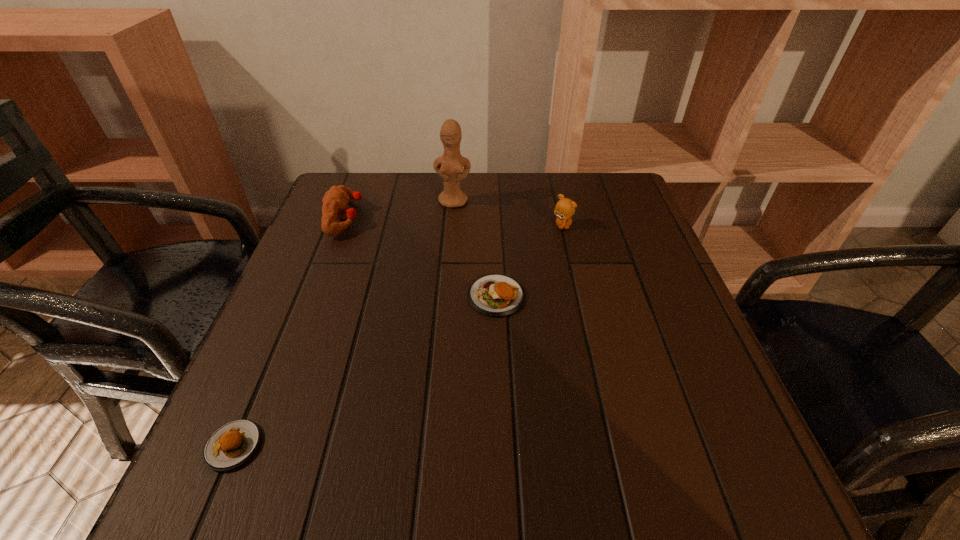
At what (x,y) coordinates should I click in order to perform the action: click on free region at the far edge. Please return your answer as a coordinate pair (x, y). This screenshot has width=960, height=540. Looking at the image, I should click on (485, 218).

You are a GUI agent. You are given a task and a screenshot of the screen. Output one action in this format:
    pyautogui.click(x=<x>, y=<y>)
    Task: Click on the vacant space at the near edge of the desktop
    Image resolution: width=960 pixels, height=540 pixels.
    Given the screenshot: What is the action you would take?
    pyautogui.click(x=648, y=476)

Locate an element on the screen. vacant space at the left edge of the desktop is located at coordinates [x=278, y=363].

Identify the location of vacant space at the right edge of the desktop. (652, 342).

Locate an element on the screen. The width and height of the screenshot is (960, 540). free space at the far left corner is located at coordinates (385, 189).

This screenshot has width=960, height=540. What are the coordinates of `vacant region at the far right corner of the desktop` in the screenshot? It's located at (588, 205).

The height and width of the screenshot is (540, 960). Identify the location of vacant space at the near right corner. (679, 475).

The height and width of the screenshot is (540, 960). I want to click on free spot between the figurine and the nearer food, so click(344, 323).

The height and width of the screenshot is (540, 960). Identify the location of free point between the nearest object and the third shortest object. (289, 332).

The height and width of the screenshot is (540, 960). I want to click on free point between the third shortest object and the right food, so click(x=420, y=257).